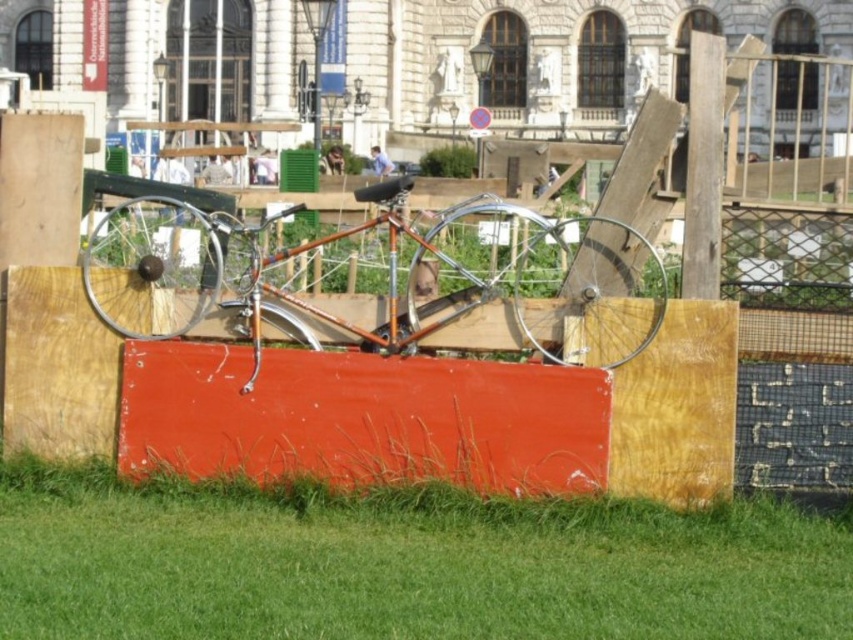
Is point (660, 566) positioned in front of point (567, 252)?

Yes, point (660, 566) is closer to viewer.

Does green grass at lower center have a larger size compared to shiny orange bicycle at center?

No, green grass at lower center is not bigger than shiny orange bicycle at center.

Is point (639, 529) closer to viewer compared to point (546, 241)?

Yes, it is.

Image resolution: width=853 pixels, height=640 pixels. Identify the location of green grass at lower center. (404, 563).